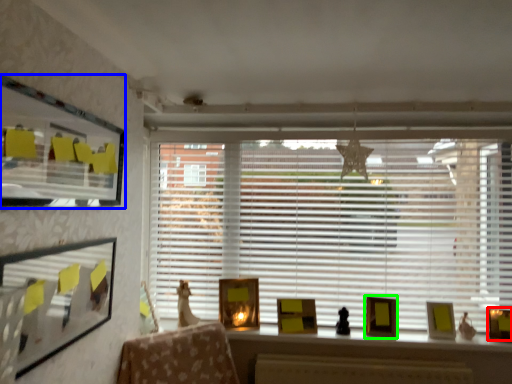
Question: Based on their relative distances, which object is farther from picture frame (highlighted by a red box)? Choose from window screen (highlighted by a blue box) and picture frame (highlighted by a green box).

Choices:
 (A) window screen
 (B) picture frame

Answer: (A)